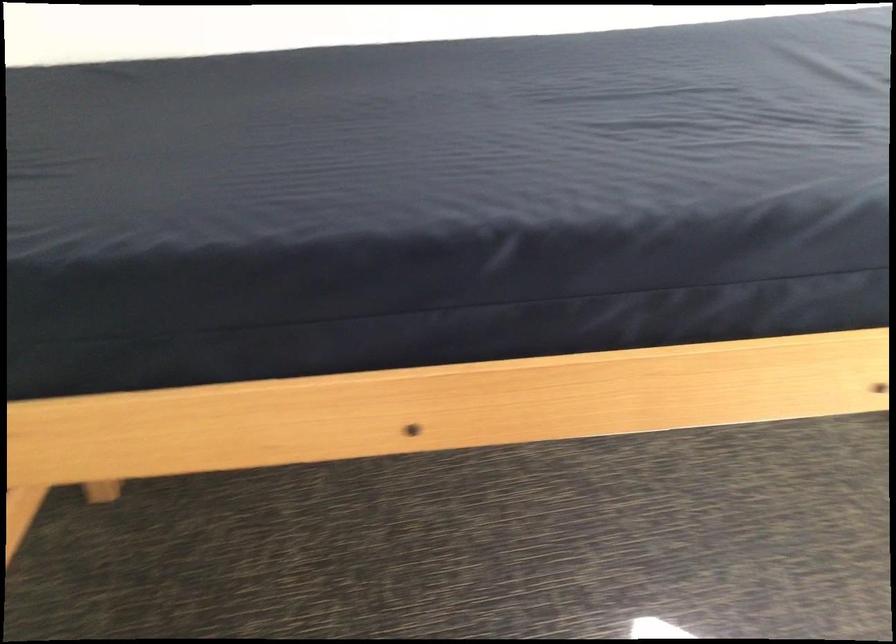
Find the location of a particular element. blue mattress edge is located at coordinates (254, 308).